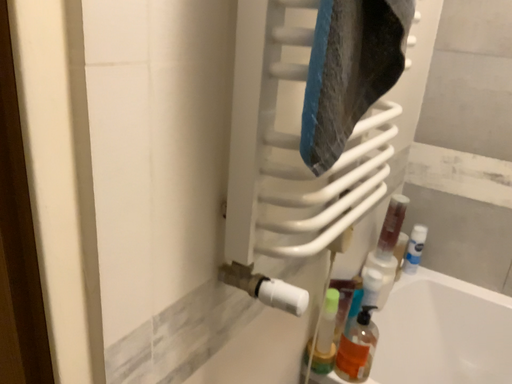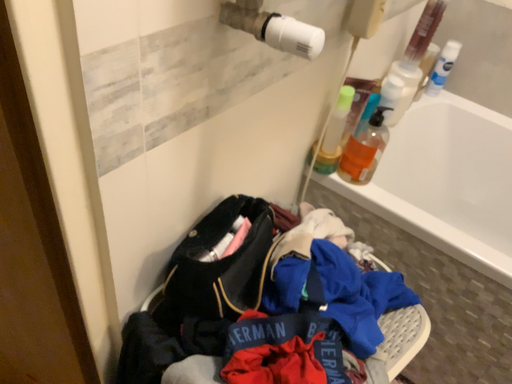
Question: How did the camera likely rotate when shooting the video?

Choices:
 (A) rotated downward
 (B) rotated upward

Answer: (A)